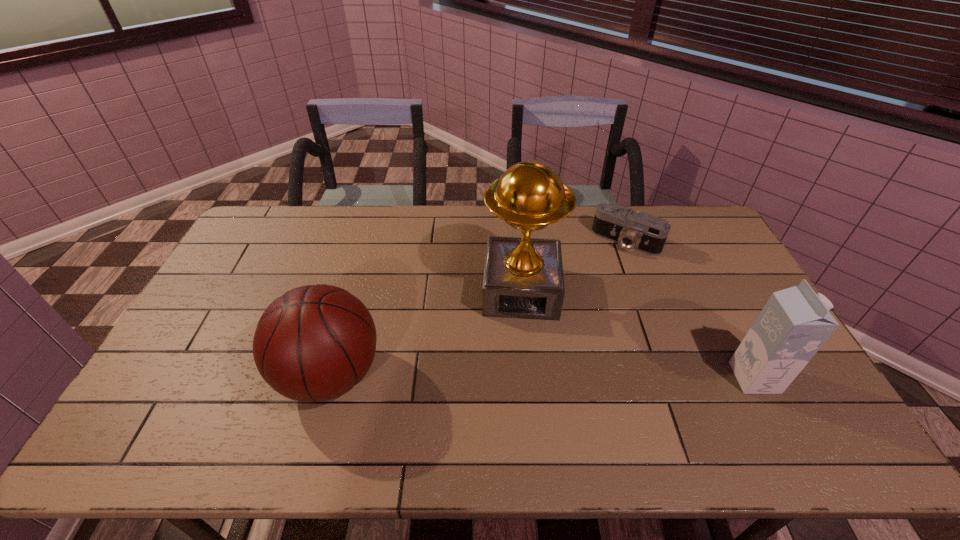
The image size is (960, 540). Identify the location of unoccupied position between the tallest object and the second object from right to left. (573, 266).

Locate an element on the screen. This screenshot has width=960, height=540. free space between the award and the basketball is located at coordinates (426, 333).

Locate an element on the screen. The image size is (960, 540). vacant space that is in between the second object from right to left and the leftmost object is located at coordinates (478, 308).

This screenshot has width=960, height=540. I want to click on vacant space in between the third nearest object and the rightmost object, so click(637, 334).

Select which object appears as the second closest to the tallest object. Please provide its 2D coordinates. Your answer should be formatted as a tuple, i.e. [(x, y)], where the tuple contains the x and y coordinates of a point satisfying the conditions above.

[(314, 343)]

Identify which object is the third closest to the shortest object. Please provide its 2D coordinates. Your answer should be formatted as a tuple, i.e. [(x, y)], where the tuple contains the x and y coordinates of a point satisfying the conditions above.

[(314, 343)]

Find the location of `vacant space that satisfies the following two spatial constraints: 1. on the front side of the rightmost object; 2. on the front label of the second object from right to left`. vacant space that satisfies the following two spatial constraints: 1. on the front side of the rightmost object; 2. on the front label of the second object from right to left is located at coordinates (677, 378).

The width and height of the screenshot is (960, 540). Identify the location of blank area in the image that satisfies the following two spatial constraints: 1. on the back side of the camera; 2. on the left side of the leftmost object. (369, 241).

The width and height of the screenshot is (960, 540). What are the coordinates of `vacant area that satisfies the following two spatial constraints: 1. on the front side of the rightmost object; 2. on the front label of the basketball` in the screenshot? It's located at (329, 378).